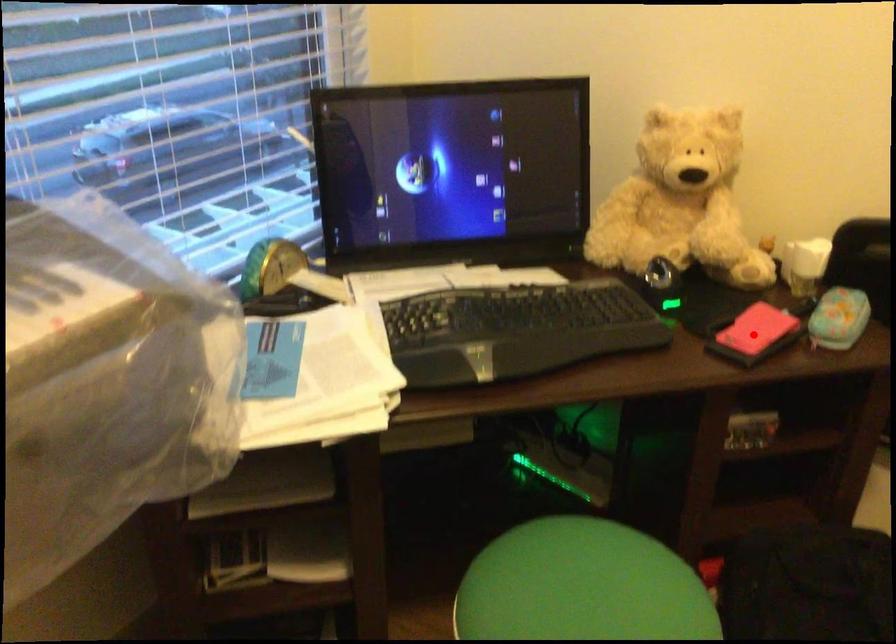
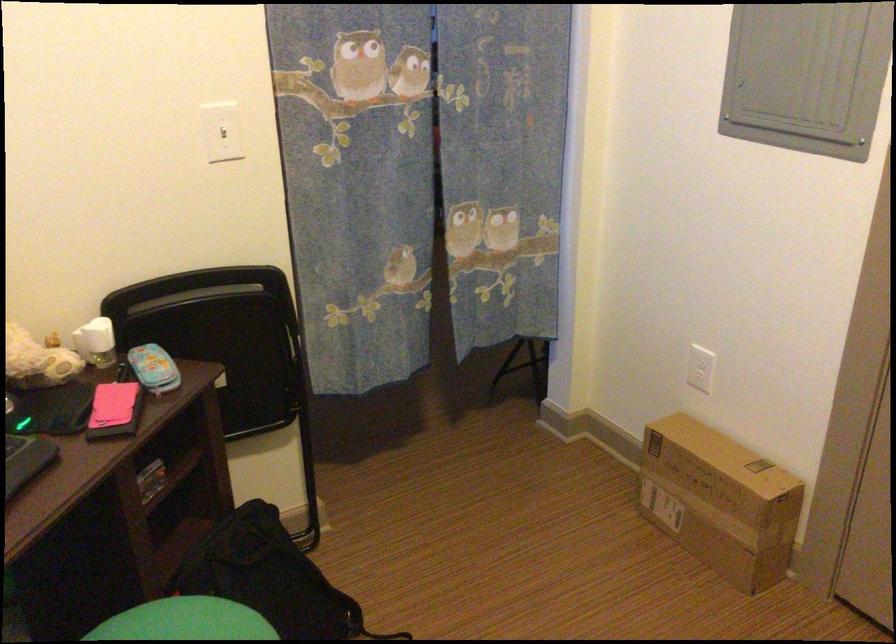
Question: A red point is marked in image1. In image2, is the corresponding 3D point closer to the camera or farther? Reply with the corresponding letter.

Choices:
 (A) The corresponding 3D point is closer.
 (B) The corresponding 3D point is farther.

Answer: (B)